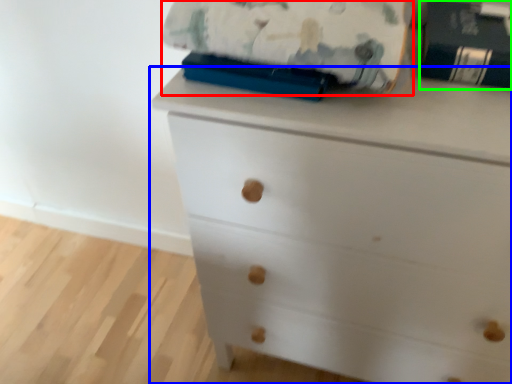
Question: Based on their relative distances, which object is farther from blanket (highlighted by a red box)? Choose from chest of drawers (highlighted by a blue box) and paperback book (highlighted by a green box).

Choices:
 (A) chest of drawers
 (B) paperback book

Answer: (A)